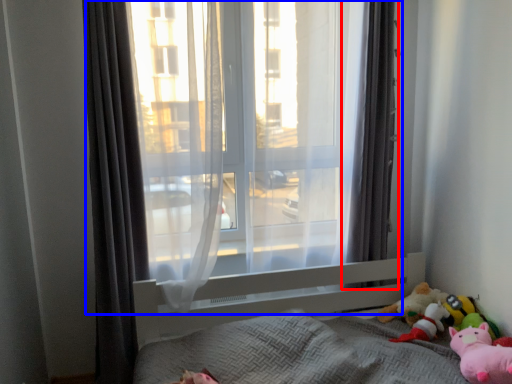
Question: Which object appears farthest to the camera in this image, curtain (highlighted by a red box) or window (highlighted by a blue box)?

Choices:
 (A) curtain
 (B) window

Answer: (A)